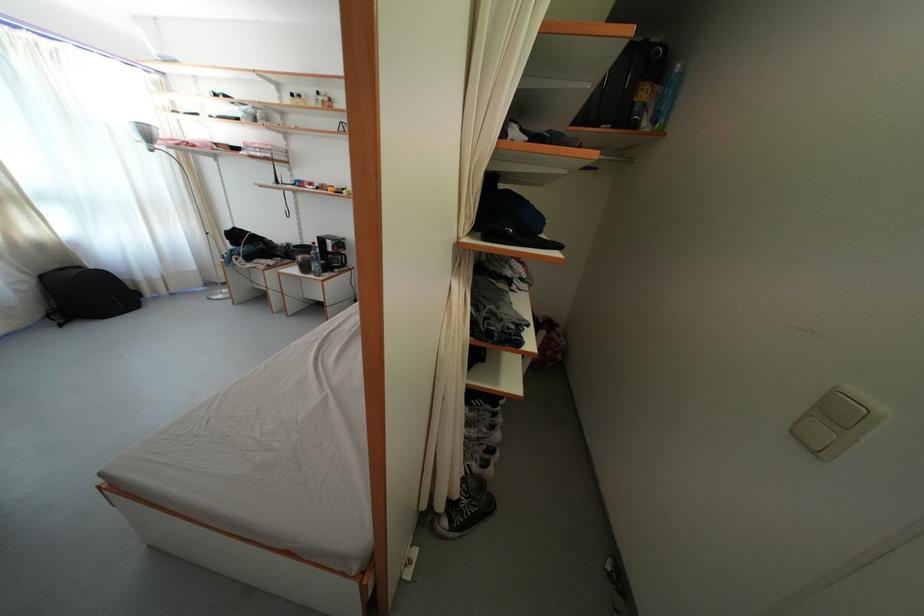
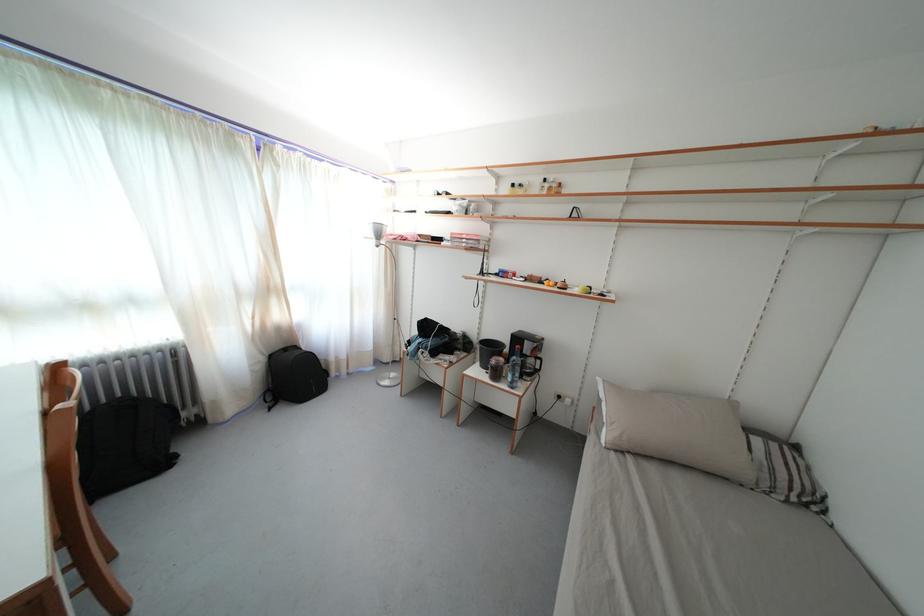
The images are taken continuously from a first-person perspective. In which direction are you moving?

The cameraman moved toward left, forward.